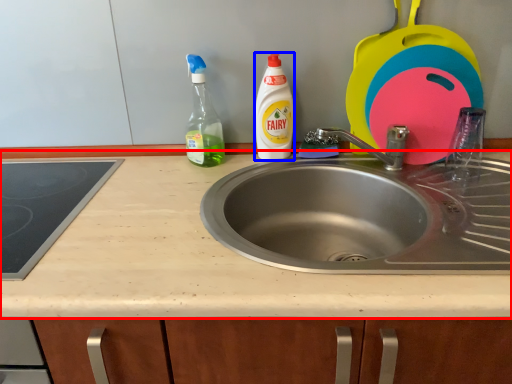
Question: Which of the following is the farthest to the observer, countertop (highlighted by a red box) or cleaning product (highlighted by a blue box)?

Choices:
 (A) countertop
 (B) cleaning product

Answer: (B)